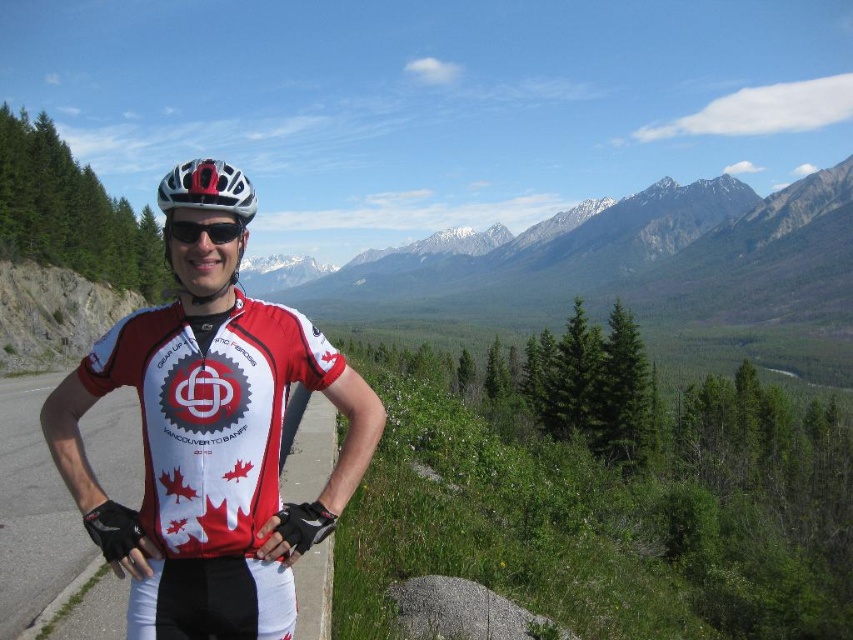
Question: Which point is closer to the camera taking this photo?

Choices:
 (A) (173, 196)
 (B) (242, 225)
 (C) (200, 579)

Answer: (C)

Question: Among these points, which one is farthest from the camera?

Choices:
 (A) (206, 182)
 (B) (222, 164)

Answer: (B)

Question: Based on their relative distances, which object is farther from the black matte sunglasses at center?

Choices:
 (A) white matte cycling jersey at center
 (B) white matte bicycle helmet at center

Answer: (A)

Question: Can you confirm if white matte cycling jersey at center is thinner than white matte bicycle helmet at center?

Choices:
 (A) yes
 (B) no

Answer: (A)

Question: Can you confirm if white matte bicycle helmet at center is wider than black matte sunglasses at center?

Choices:
 (A) no
 (B) yes

Answer: (B)

Question: Does white matte helmet at center appear on the right side of black matte sunglasses at center?

Choices:
 (A) no
 (B) yes

Answer: (A)